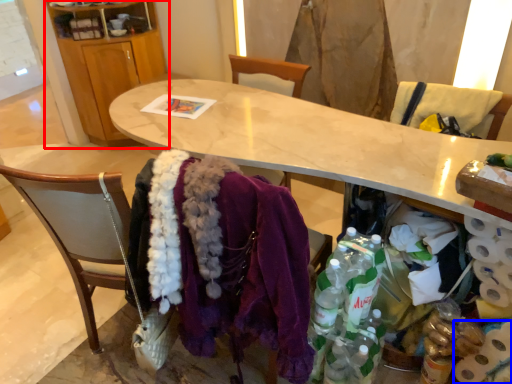
Question: Among these objects, which one is farthest to the camera, cabinetry (highlighted by a red box) or toilet paper (highlighted by a blue box)?

Choices:
 (A) cabinetry
 (B) toilet paper

Answer: (A)